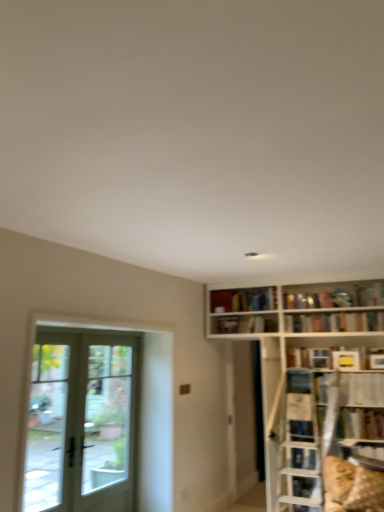
Question: Is white plastic shelf at upper right further to the viewer compared to yellow matte bookshelf at upper right, which appears as the fourth book when viewed from the top?

Choices:
 (A) no
 (B) yes

Answer: (A)

Question: From a real-world perspective, is white plastic shelf at upper right below yellow matte bookshelf at upper right, which appears as the fourth book when viewed from the top?

Choices:
 (A) no
 (B) yes

Answer: (B)

Question: Is white plastic shelf at upper right at the right side of yellow matte bookshelf at upper right, marked as the second book in a right-to-left arrangement?

Choices:
 (A) no
 (B) yes

Answer: (B)

Question: Does white plastic shelf at upper right have a lesser height compared to yellow matte bookshelf at upper right, which appears as the fourth book when viewed from the top?

Choices:
 (A) no
 (B) yes

Answer: (A)

Question: Does white plastic shelf at upper right have a greater width compared to yellow matte bookshelf at upper right, positioned as the second book in bottom-to-top order?

Choices:
 (A) no
 (B) yes

Answer: (B)

Question: In terms of size, does clear glass door at left appear bigger or smaller than hardcover book at upper right, which is the second book from left to right?

Choices:
 (A) small
 (B) big

Answer: (B)

Question: From the image's perspective, relative to hardcover book at upper right, which is counted as the fourth book, starting from the right, is clear glass door at left above or below?

Choices:
 (A) above
 (B) below

Answer: (B)

Question: From a real-world perspective, is clear glass door at left above or below hardcover book at upper right, marked as the 1th book in a bottom-to-top arrangement?

Choices:
 (A) above
 (B) below

Answer: (B)

Question: In the image, is clear glass door at left positioned in front of or behind hardcover book at upper right, which is counted as the fifth book, starting from the top?

Choices:
 (A) behind
 (B) front

Answer: (B)

Question: Considering the positions of white matte bookshelf at upper center, which ranks as the first book in left-to-right order, and clear glass door at left in the image, is white matte bookshelf at upper center, which ranks as the first book in left-to-right order, bigger or smaller than clear glass door at left?

Choices:
 (A) big
 (B) small

Answer: (B)

Question: In the image, is white matte bookshelf at upper center, the fifth book when ordered from right to left, on the left side or the right side of clear glass door at left?

Choices:
 (A) left
 (B) right

Answer: (B)

Question: Is point (221, 329) positioned closer to the camera than point (119, 353)?

Choices:
 (A) closer
 (B) farther

Answer: (B)

Question: Looking at their shapes, would you say white matte bookshelf at upper center, marked as the 3th book in a bottom-to-top arrangement, is wider or thinner than clear glass door at left?

Choices:
 (A) wide
 (B) thin

Answer: (B)

Question: In terms of height, does clear glass door at left look taller or shorter compared to white matte bookshelf at upper center, which ranks as the first book in left-to-right order?

Choices:
 (A) tall
 (B) short

Answer: (A)

Question: Would you say clear glass door at left is to the left or to the right of white matte bookshelf at upper center, marked as the 3th book in a bottom-to-top arrangement, in the picture?

Choices:
 (A) right
 (B) left

Answer: (B)